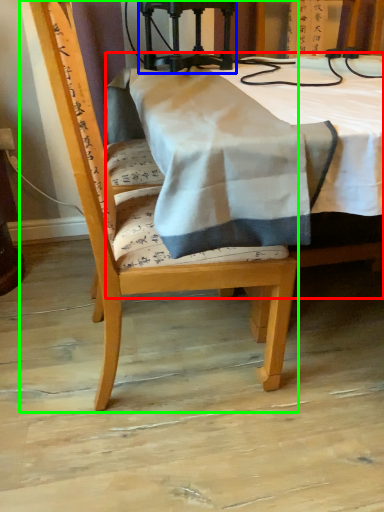
Question: Estimate the real-world distances between objects in this image. Which object is closer to table (highlighted by a red box), equipment (highlighted by a blue box) or chair (highlighted by a green box)?

Choices:
 (A) equipment
 (B) chair

Answer: (A)